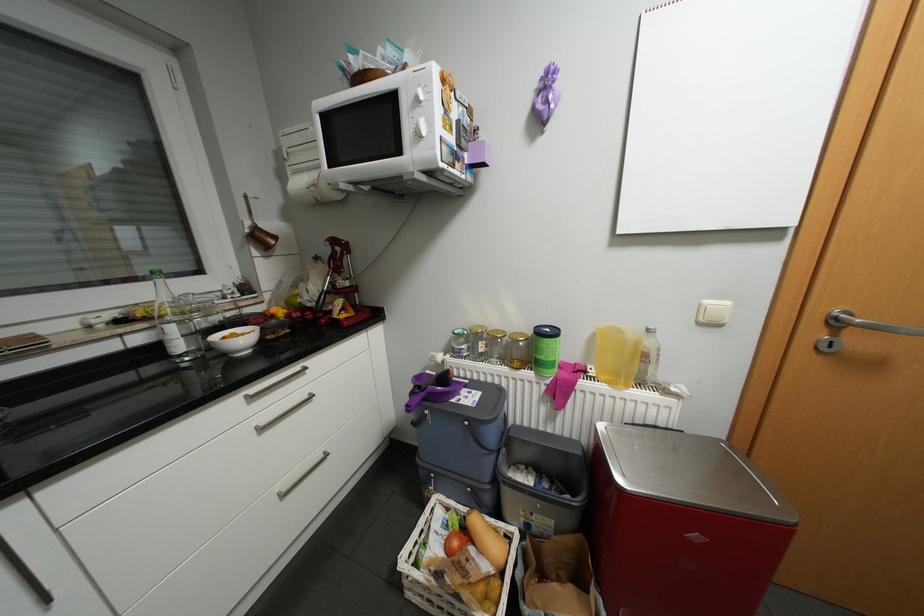
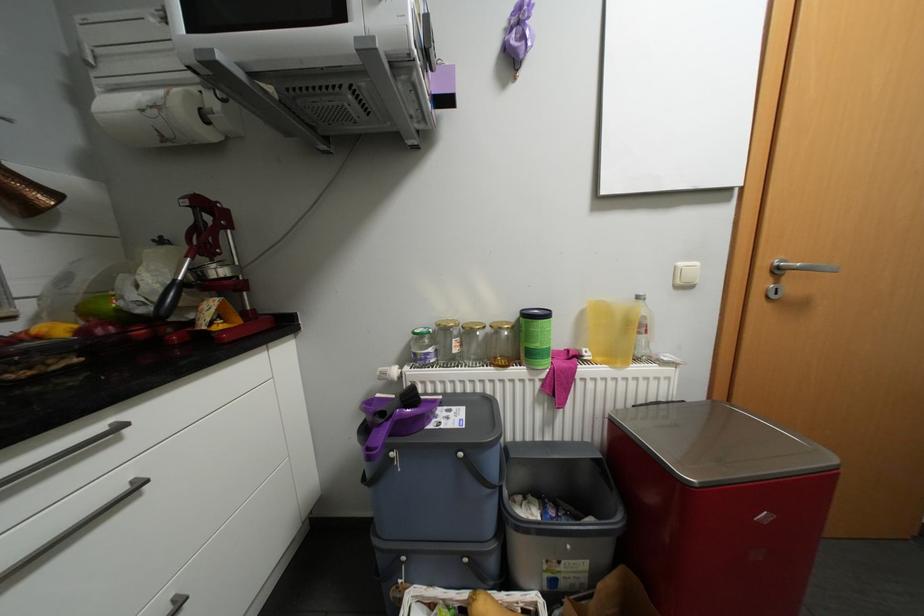
Question: The camera is either moving clockwise (left) or counter-clockwise (right) around the object. The first image is from the beginning of the video and the second image is from the end. Is the camera moving left or right when shooting the video?

Choices:
 (A) Left
 (B) Right

Answer: (A)